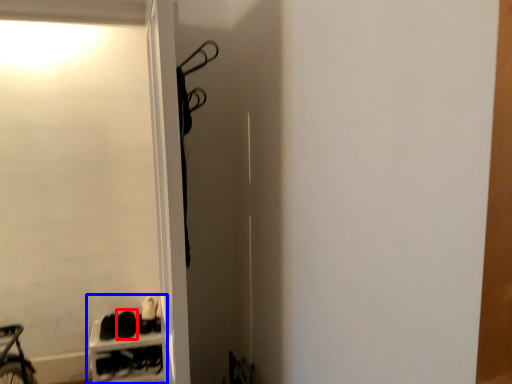
Question: Which of the following is the closest to the observer, footwear (highlighted by a red box) or bookshelf (highlighted by a blue box)?

Choices:
 (A) footwear
 (B) bookshelf

Answer: (B)